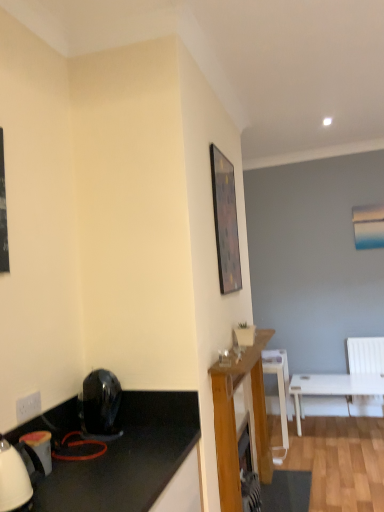
Question: Is wooden framed picture at upper center positioned with its back to transparent glass coffee cup at center?

Choices:
 (A) yes
 (B) no

Answer: (B)

Question: Is wooden framed picture at upper center directly adjacent to transparent glass coffee cup at center?

Choices:
 (A) yes
 (B) no

Answer: (B)

Question: Can we say wooden framed picture at upper center lies outside transparent glass coffee cup at center?

Choices:
 (A) yes
 (B) no

Answer: (A)

Question: Is the position of wooden framed picture at upper center more distant than that of transparent glass coffee cup at center?

Choices:
 (A) no
 (B) yes

Answer: (B)

Question: From a real-world perspective, does wooden framed picture at upper center sit lower than transparent glass coffee cup at center?

Choices:
 (A) no
 (B) yes

Answer: (A)

Question: From the image's perspective, is wooden framed picture at upper center above or below white glossy kettle at lower left, which is counted as the 1th appliance, starting from the left?

Choices:
 (A) above
 (B) below

Answer: (A)

Question: In terms of size, does wooden framed picture at upper center appear bigger or smaller than white glossy kettle at lower left, which is counted as the 1th appliance, starting from the left?

Choices:
 (A) small
 (B) big

Answer: (B)

Question: Is point (221, 276) positioned closer to the camera than point (43, 450)?

Choices:
 (A) farther
 (B) closer

Answer: (A)

Question: Considering their positions, is wooden framed picture at upper center located in front of or behind white glossy kettle at lower left, which is counted as the 1th appliance, starting from the left?

Choices:
 (A) behind
 (B) front

Answer: (A)

Question: Is white plastic power outlet at lower left situated inside wooden framed picture at upper center or outside?

Choices:
 (A) outside
 (B) inside

Answer: (A)

Question: Relative to wooden framed picture at upper center, is white plastic power outlet at lower left in front or behind?

Choices:
 (A) front
 (B) behind

Answer: (A)

Question: Considering the positions of white plastic power outlet at lower left and wooden framed picture at upper center in the image, is white plastic power outlet at lower left wider or thinner than wooden framed picture at upper center?

Choices:
 (A) wide
 (B) thin

Answer: (B)

Question: Is white plastic power outlet at lower left bigger or smaller than wooden framed picture at upper center?

Choices:
 (A) big
 (B) small

Answer: (B)

Question: From their relative heights in the image, would you say black glossy hairdryer at lower left, which is the first appliance in right-to-left order, is taller or shorter than transparent glass coffee cup at center?

Choices:
 (A) short
 (B) tall

Answer: (B)

Question: From the image's perspective, is black glossy hairdryer at lower left, which is the first appliance in right-to-left order, above or below transparent glass coffee cup at center?

Choices:
 (A) below
 (B) above

Answer: (A)